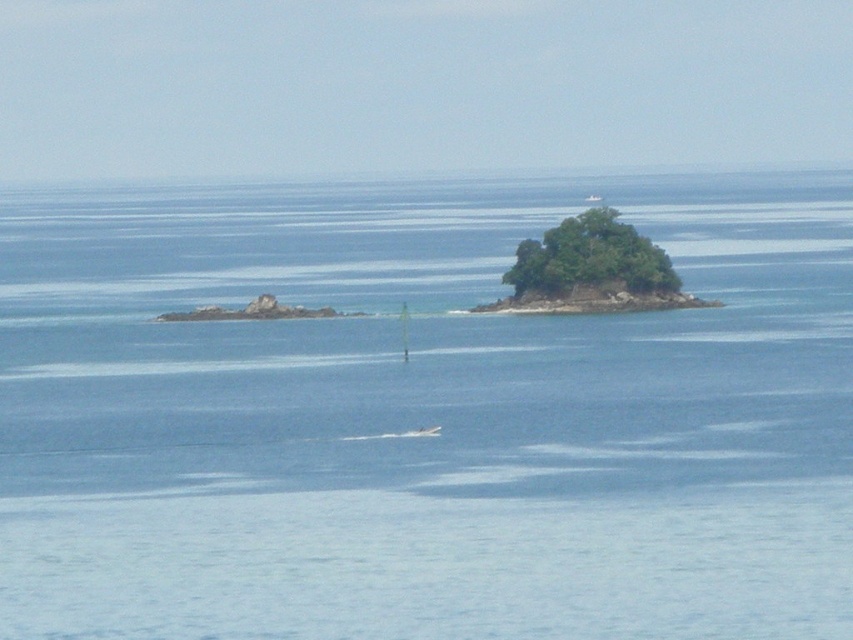
Question: Can you confirm if blue water at center is wider than green mossy rock at left?

Choices:
 (A) no
 (B) yes

Answer: (B)

Question: Is green mossy rock at left smaller than white plastic boat at center?

Choices:
 (A) yes
 (B) no

Answer: (B)

Question: Which point appears farthest from the camera in this image?

Choices:
 (A) (360, 388)
 (B) (427, 435)

Answer: (A)

Question: Does green leafy island at center come behind green mossy rock at left?

Choices:
 (A) no
 (B) yes

Answer: (B)

Question: Among these points, which one is farthest from the camera?

Choices:
 (A) (430, 429)
 (B) (321, 310)
 (C) (598, 292)
 (D) (326, 240)

Answer: (D)

Question: Based on their relative distances, which object is nearer to the green mossy rock at left?

Choices:
 (A) white plastic boat at center
 (B) green leafy island at center
 (C) blue water at center

Answer: (B)